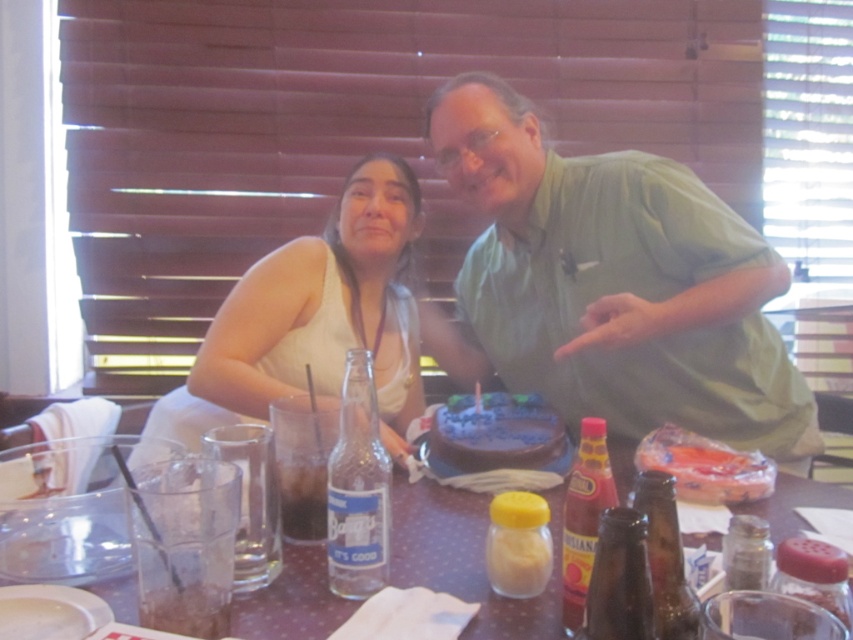
Which is more to the left, brown speckled table at center or blue frosted cake at center?

From the viewer's perspective, brown speckled table at center appears more on the left side.

Who is lower down, brown speckled table at center or blue frosted cake at center?

Positioned lower is brown speckled table at center.

Find the location of `brown speckled table at center`. brown speckled table at center is located at coordinates (466, 557).

Is green cotton shirt at center below brown speckled table at center?

No.

Is point (497, 348) farther from viewer compared to point (627, 461)?

Yes, it is.

Which is behind, point (589, 172) or point (850, 496)?

Point (589, 172)

Where is `green cotton shirt at center`? Image resolution: width=853 pixels, height=640 pixels. green cotton shirt at center is located at coordinates (610, 284).

What do you see at coordinates (315, 317) in the screenshot?
I see `white fabric shirt at left` at bounding box center [315, 317].

Does white fabric shirt at left appear under blue frosted cake at center?

Incorrect, white fabric shirt at left is not positioned below blue frosted cake at center.

Is point (395, 372) behind point (515, 403)?

Yes, it is.

Where is `white fabric shirt at left`? The width and height of the screenshot is (853, 640). white fabric shirt at left is located at coordinates (315, 317).